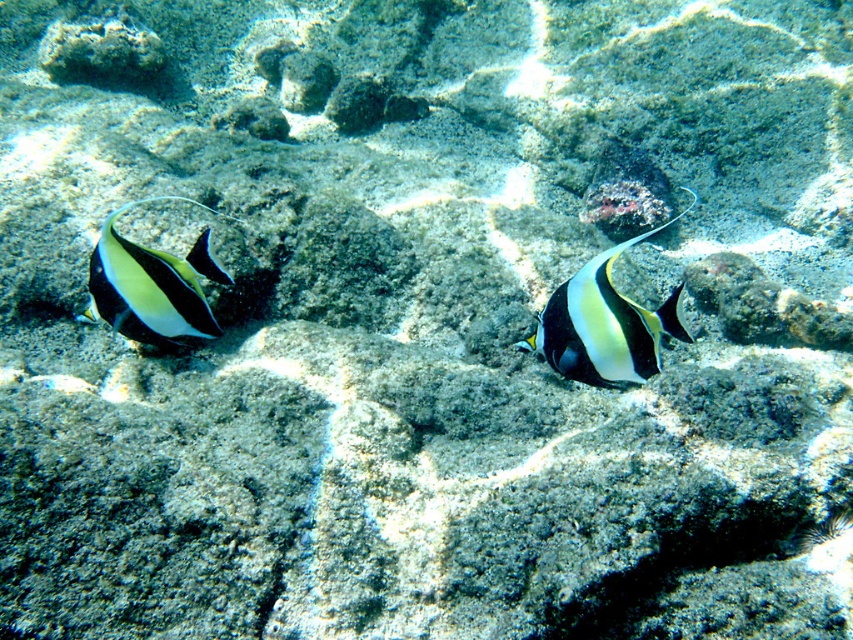
You are a marine biologist observing underwater life. You notice the black glossy fish at center and the shiny silver fish at left. Based on their widths, which fish would you estimate to be smaller in size?

The black glossy fish at center has a lesser width compared to the shiny silver fish at left, so it would be estimated to be smaller in size.

You are a marine biologist observing underwater. You need to capture a photo of the black glossy fish at center from a distance of 4 feet. Can you take the photo without moving closer?

The black glossy fish at center and viewer are 4.11 feet apart from each other, so yes, you can take the photo without moving closer as the distance is sufficient.

You are a marine biologist studying the underwater scene. You notice a point marked at coordinates (604,324). Based on the image description, which object does this point correspond to?

The point at coordinates (604,324) is on the black glossy fish at center.